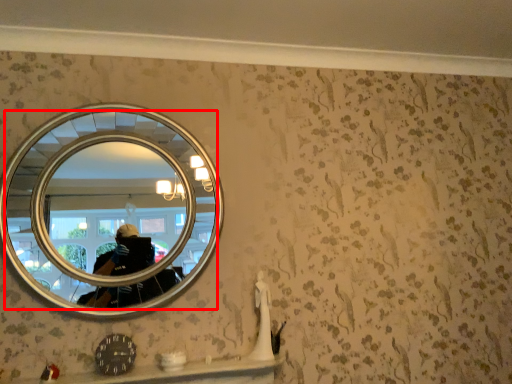
Question: From the image's perspective, what is the correct spatial positioning of mirror (annotated by the red box) in reference to ledge?

Choices:
 (A) above
 (B) below

Answer: (A)